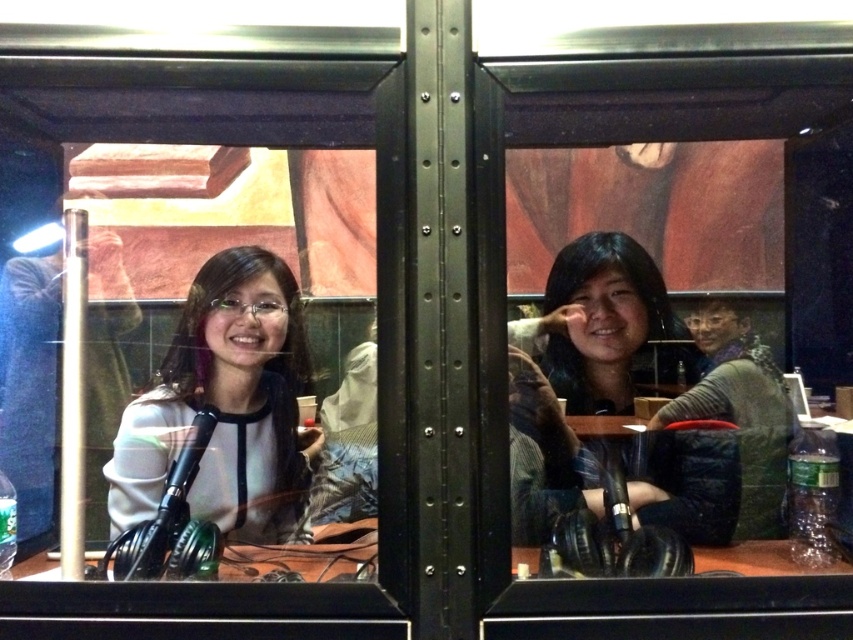
You are standing in front of the booth and want to reach the two points marked in the image. Which point, point 1 at coordinates (202,516) or point 2 at coordinates (646,500), is closer to you?

Point 1 at coordinates (202,516) is closer to you because it is further to the viewer than point 2 at coordinates (646,500).

Consider the image. You are a photographer setting up a photo shoot in the booth. You need to place a large decorative plant between the white matte sweater at left and the matte black shirt at center. Will the plant fit in the space between them?

The white matte sweater at left occupies less space than the matte black shirt at center, so the space between them might be sufficient for the plant. However, since the sweater is smaller, the exact fit depends on the plant size. If the plant is not excessively large, it should fit.